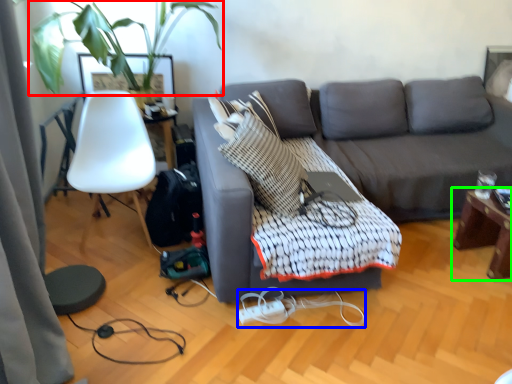
Question: Which object is positioned closest to plant (highlighted by a red box)? Select from cable (highlighted by a blue box) and table (highlighted by a green box).

Choices:
 (A) cable
 (B) table

Answer: (A)